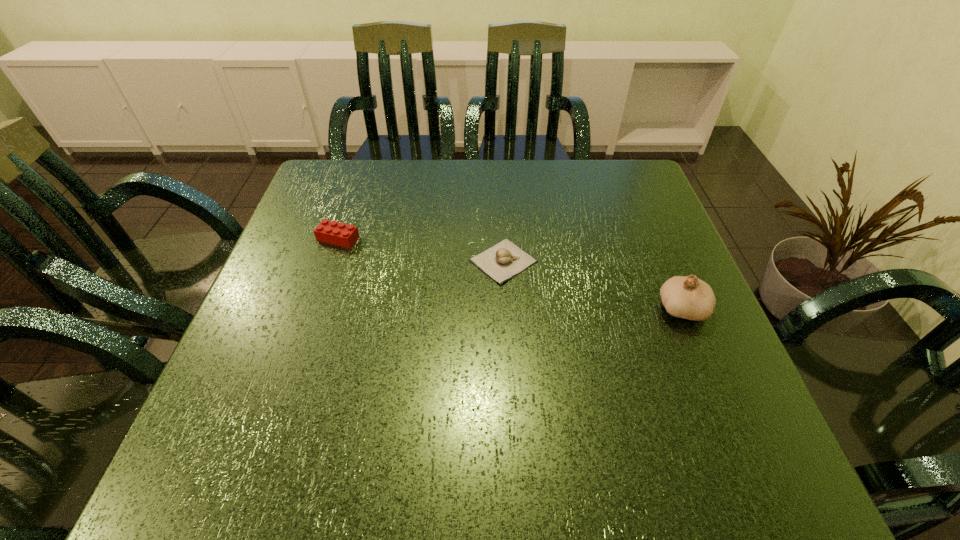
Find the location of a particular element. This screenshot has width=960, height=540. vacant space that is in between the left garlic and the leftmost object is located at coordinates (420, 249).

This screenshot has height=540, width=960. I want to click on free space between the second shortest object and the left garlic, so click(x=420, y=249).

The height and width of the screenshot is (540, 960). In order to click on vacant region between the Lego and the farther garlic in this screenshot , I will do `click(420, 249)`.

The width and height of the screenshot is (960, 540). In order to click on unoccupied position between the second shortest object and the farther garlic in this screenshot , I will do click(420, 249).

At what (x,y) coordinates should I click in order to perform the action: click on unoccupied area between the shortest object and the Lego. Please return your answer as a coordinate pair (x, y). Image resolution: width=960 pixels, height=540 pixels. Looking at the image, I should click on (420, 249).

This screenshot has width=960, height=540. Identify the location of free space that is in between the taller garlic and the shorter garlic. (592, 284).

The image size is (960, 540). I want to click on the closest object relative to the Lego, so click(502, 261).

Identify which object is the nearest to the left garlic. Please provide its 2D coordinates. Your answer should be formatted as a tuple, i.e. [(x, y)], where the tuple contains the x and y coordinates of a point satisfying the conditions above.

[(688, 297)]

Locate an element on the screen. The width and height of the screenshot is (960, 540). free location that satisfies the following two spatial constraints: 1. on the front side of the nearer garlic; 2. on the right side of the shorter garlic is located at coordinates (506, 308).

At what (x,y) coordinates should I click in order to perform the action: click on vacant position in the image that satisfies the following two spatial constraints: 1. on the front side of the shortest object; 2. on the right side of the second shortest object. Please return your answer as a coordinate pair (x, y). Image resolution: width=960 pixels, height=540 pixels. Looking at the image, I should click on (331, 260).